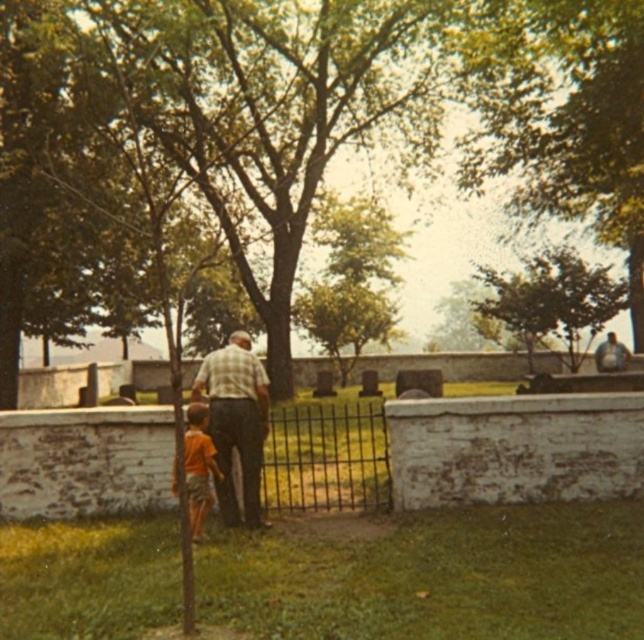
Based on the photo, between black wrought iron gate at center and orange cotton shirt at lower left, which one is positioned higher?

orange cotton shirt at lower left is above.

Which is in front, point (261, 472) or point (191, 452)?

Positioned in front is point (191, 452).

Which is behind, point (310, 424) or point (196, 424)?

The point (310, 424) is more distant.

You are a GUI agent. You are given a task and a screenshot of the screen. Output one action in this format:
    pyautogui.click(x=<x>, y=<y>)
    Task: Click on the black wrought iron gate at center
    Image resolution: width=644 pixels, height=640 pixels.
    Given the screenshot: What is the action you would take?
    pyautogui.click(x=327, y=458)

Which is more to the left, orange cotton shirt at lower left or matte gray shirt at upper right?

Positioned to the left is orange cotton shirt at lower left.

Is the position of orange cotton shirt at lower left less distant than that of matte gray shirt at upper right?

Yes.

Locate an element on the screen. The image size is (644, 640). orange cotton shirt at lower left is located at coordinates (198, 467).

Identify the location of orange cotton shirt at lower left. (198, 467).

From the picture: Between plaid fabric at center and matte gray shirt at upper right, which one appears on the right side from the viewer's perspective?

Positioned to the right is matte gray shirt at upper right.

Is plaid fabric at center taller than matte gray shirt at upper right?

No.

Image resolution: width=644 pixels, height=640 pixels. What do you see at coordinates (234, 422) in the screenshot? I see `plaid fabric at center` at bounding box center [234, 422].

Find the location of `plaid fabric at center`. plaid fabric at center is located at coordinates (234, 422).